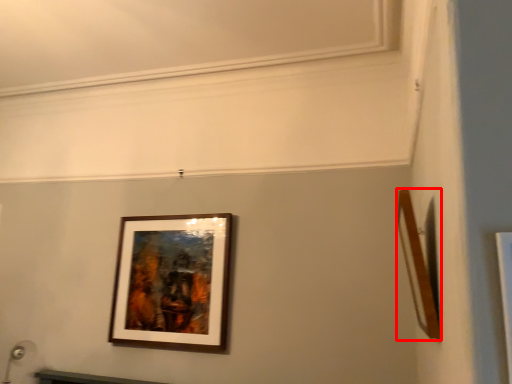
Question: From the image's perspective, where is picture frame (annotated by the red box) located in relation to picture frame in the image?

Choices:
 (A) below
 (B) above

Answer: (B)